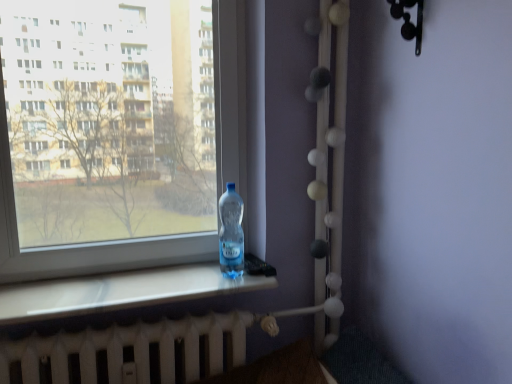
Question: Could white matte radiator at bottom be considered to be inside transparent plastic bottle at left?

Choices:
 (A) no
 (B) yes

Answer: (A)

Question: Does transparent plastic bottle at left have a greater width compared to white matte radiator at bottom?

Choices:
 (A) no
 (B) yes

Answer: (A)

Question: Is transparent plastic bottle at left further to camera compared to white matte radiator at bottom?

Choices:
 (A) no
 (B) yes

Answer: (B)

Question: Is transparent plastic bottle at left positioned beyond the bounds of white matte radiator at bottom?

Choices:
 (A) yes
 (B) no

Answer: (A)

Question: Can you confirm if transparent plastic bottle at left is positioned to the left of white matte radiator at bottom?

Choices:
 (A) no
 (B) yes

Answer: (B)

Question: Is white matte radiator at bottom situated inside transparent plastic bottle at left or outside?

Choices:
 (A) inside
 (B) outside

Answer: (B)

Question: From the image's perspective, is white matte radiator at bottom positioned above or below transparent plastic bottle at left?

Choices:
 (A) above
 (B) below

Answer: (B)

Question: Relative to transparent plastic bottle at left, is white matte radiator at bottom in front or behind?

Choices:
 (A) behind
 (B) front

Answer: (B)

Question: Looking at the image, does white matte radiator at bottom seem bigger or smaller compared to transparent plastic bottle at left?

Choices:
 (A) big
 (B) small

Answer: (B)

Question: From the image's perspective, relative to transparent plastic bottle at window, is white matte radiator at bottom above or below?

Choices:
 (A) above
 (B) below

Answer: (B)

Question: In the image, is white matte radiator at bottom on the left side or the right side of transparent plastic bottle at window?

Choices:
 (A) right
 (B) left

Answer: (B)

Question: Considering the positions of white matte radiator at bottom and transparent plastic bottle at window in the image, is white matte radiator at bottom wider or thinner than transparent plastic bottle at window?

Choices:
 (A) wide
 (B) thin

Answer: (A)

Question: In the image, is white matte radiator at bottom positioned in front of or behind transparent plastic bottle at window?

Choices:
 (A) behind
 (B) front

Answer: (B)

Question: Is transparent plastic bottle at left in front of or behind transparent plastic bottle at window in the image?

Choices:
 (A) behind
 (B) front

Answer: (B)

Question: Is transparent plastic bottle at left inside or outside of transparent plastic bottle at window?

Choices:
 (A) inside
 (B) outside

Answer: (B)